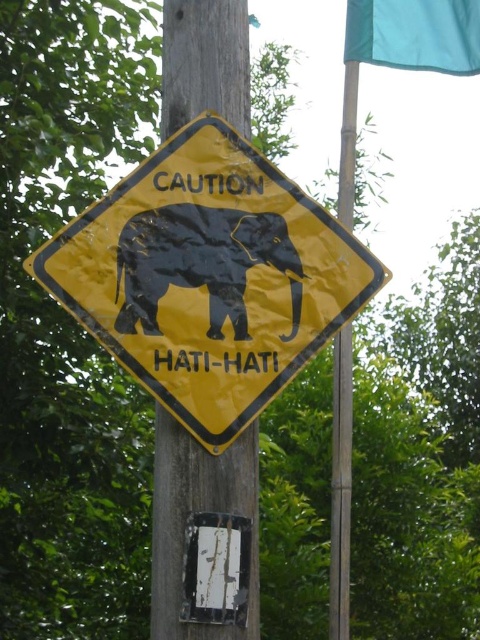
Question: In this image, where is wooden telegraph pole at center located relative to teal fabric flag at upper right?

Choices:
 (A) below
 (B) above

Answer: (A)

Question: Is wooden telegraph pole at center in front of teal fabric flag at upper right?

Choices:
 (A) yes
 (B) no

Answer: (A)

Question: Among these objects, which one is farthest from the camera?

Choices:
 (A) teal fabric flag at upper right
 (B) black rubber elephant at center

Answer: (A)

Question: Which point appears closest to the camera in this image?

Choices:
 (A) (113, 280)
 (B) (120, 236)
 (C) (156, 429)
 (D) (432, 54)

Answer: (A)

Question: Among these objects, which one is farthest from the camera?

Choices:
 (A) yellow matte sign at center
 (B) teal fabric flag at upper right
 (C) wooden telegraph pole at center
 (D) black rubber elephant at center

Answer: (B)

Question: Is wooden telegraph pole at center below black rubber elephant at center?

Choices:
 (A) yes
 (B) no

Answer: (A)